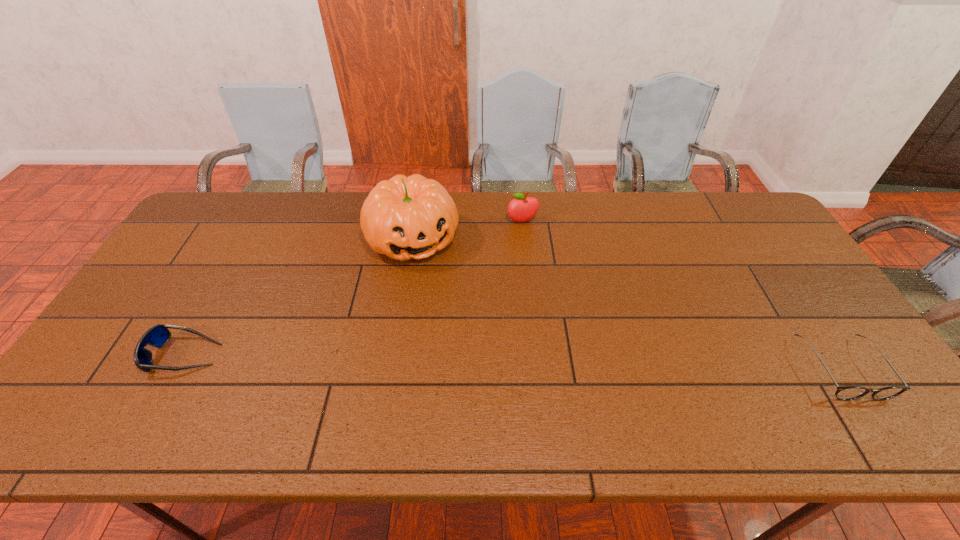
Where is `free area in between the second tallest object and the sunglasses`? This screenshot has width=960, height=540. free area in between the second tallest object and the sunglasses is located at coordinates (353, 288).

Find the location of a particular element. The image size is (960, 540). empty space that is in between the apple and the sunglasses is located at coordinates (353, 288).

At what (x,y) coordinates should I click in order to perform the action: click on vacant area that lies between the apple and the tallest object. Please return your answer as a coordinate pair (x, y). The height and width of the screenshot is (540, 960). Looking at the image, I should click on (468, 230).

Locate an element on the screen. This screenshot has width=960, height=540. free space between the apple and the pumpkin is located at coordinates (468, 230).

The image size is (960, 540). I want to click on free spot between the spectacles and the second object from right to left, so click(x=682, y=295).

At what (x,y) coordinates should I click in order to perform the action: click on vacant area that lies between the shortest object and the pumpkin. Please return your answer as a coordinate pair (x, y). Image resolution: width=960 pixels, height=540 pixels. Looking at the image, I should click on (627, 303).

Locate an element on the screen. The height and width of the screenshot is (540, 960). unoccupied area between the leftmost object and the third shortest object is located at coordinates (353, 288).

Locate an element on the screen. The height and width of the screenshot is (540, 960). vacant area that lies between the third object from right to left and the sunglasses is located at coordinates (299, 296).

Where is `object that is the third closest to the tallest object`? The height and width of the screenshot is (540, 960). object that is the third closest to the tallest object is located at coordinates (845, 393).

Where is `object that ranks as the closest to the rightmost object`? This screenshot has width=960, height=540. object that ranks as the closest to the rightmost object is located at coordinates (521, 209).